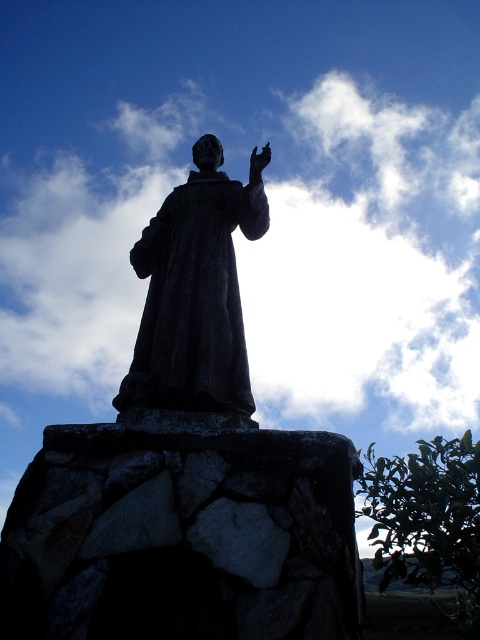
You are an art conservator examining the statue from the front. You notice the matte black hand at upper center and the matte stone statue at upper center. Which object is closer to you?

The matte stone statue at upper center is closer to you because the matte black hand at upper center is positioned behind it, meaning the statue obscures part of the hand from your view.

You are an artist trying to sketch the statue and its surroundings. When drawing the white fluffy cloud at upper center and the rough stone pedestal at center, which one should you draw first to maintain proper perspective?

You should draw the white fluffy cloud at upper center first because it is closer to the viewer than the rough stone pedestal at center, so it should be placed in front in the sketch.